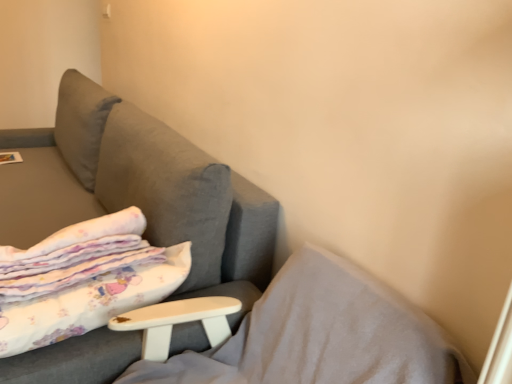
Question: Considering the relative sizes of white cotton blanket at left and white soft pillow at lower left in the image provided, is white cotton blanket at left taller than white soft pillow at lower left?

Choices:
 (A) yes
 (B) no

Answer: (B)

Question: Is white cotton blanket at left far from white soft pillow at lower left?

Choices:
 (A) no
 (B) yes

Answer: (A)

Question: Does white cotton blanket at left appear on the left side of white soft pillow at lower left?

Choices:
 (A) no
 (B) yes

Answer: (B)

Question: Is white cotton blanket at left shorter than white soft pillow at lower left?

Choices:
 (A) yes
 (B) no

Answer: (A)

Question: From the image's perspective, is white cotton blanket at left on white soft pillow at lower left?

Choices:
 (A) yes
 (B) no

Answer: (A)

Question: Is white soft pillow at lower left taller or shorter than matte white magazine at upper left?

Choices:
 (A) tall
 (B) short

Answer: (A)

Question: In the image, is white soft pillow at lower left positioned in front of or behind matte white magazine at upper left?

Choices:
 (A) front
 (B) behind

Answer: (A)

Question: Choose the correct answer: Is white soft pillow at lower left inside matte white magazine at upper left or outside it?

Choices:
 (A) inside
 (B) outside

Answer: (B)

Question: In the image, is white soft pillow at lower left on the left side or the right side of matte white magazine at upper left?

Choices:
 (A) left
 (B) right

Answer: (B)

Question: Looking at their shapes, would you say white soft pillow at lower left is wider or thinner than white cotton blanket at left?

Choices:
 (A) thin
 (B) wide

Answer: (B)

Question: From the image's perspective, is white soft pillow at lower left positioned above or below white cotton blanket at left?

Choices:
 (A) above
 (B) below

Answer: (B)

Question: In the image, is white soft pillow at lower left positioned in front of or behind white cotton blanket at left?

Choices:
 (A) front
 (B) behind

Answer: (A)

Question: From a real-world perspective, relative to white cotton blanket at left, is white soft pillow at lower left vertically above or below?

Choices:
 (A) below
 (B) above

Answer: (A)

Question: In terms of width, does white cotton blanket at left look wider or thinner when compared to matte white magazine at upper left?

Choices:
 (A) wide
 (B) thin

Answer: (A)

Question: From the image's perspective, is white cotton blanket at left located above or below matte white magazine at upper left?

Choices:
 (A) above
 (B) below

Answer: (B)